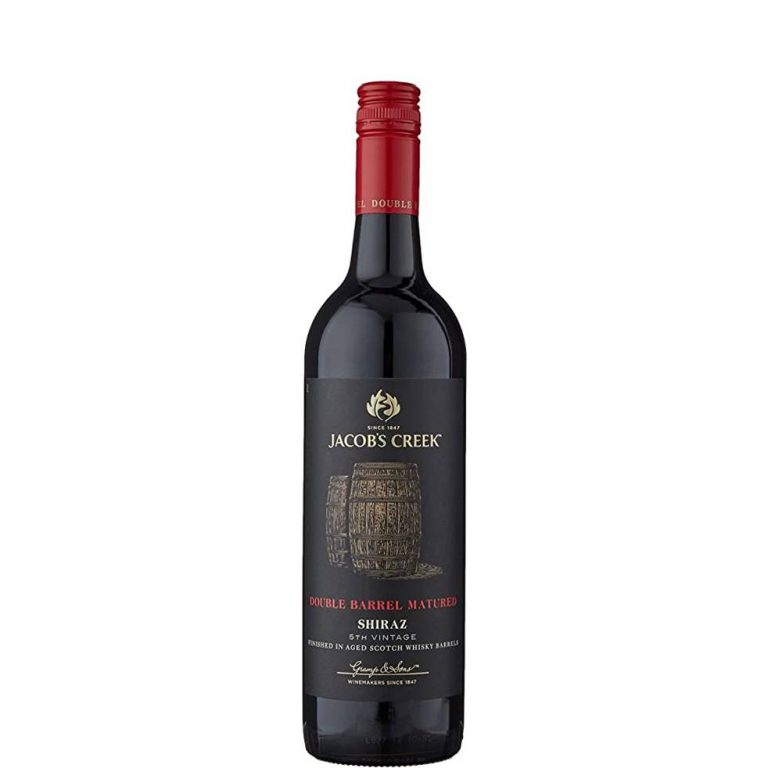
Where is `wine bottle`? The height and width of the screenshot is (768, 768). wine bottle is located at coordinates (640, 18), (392, 474).